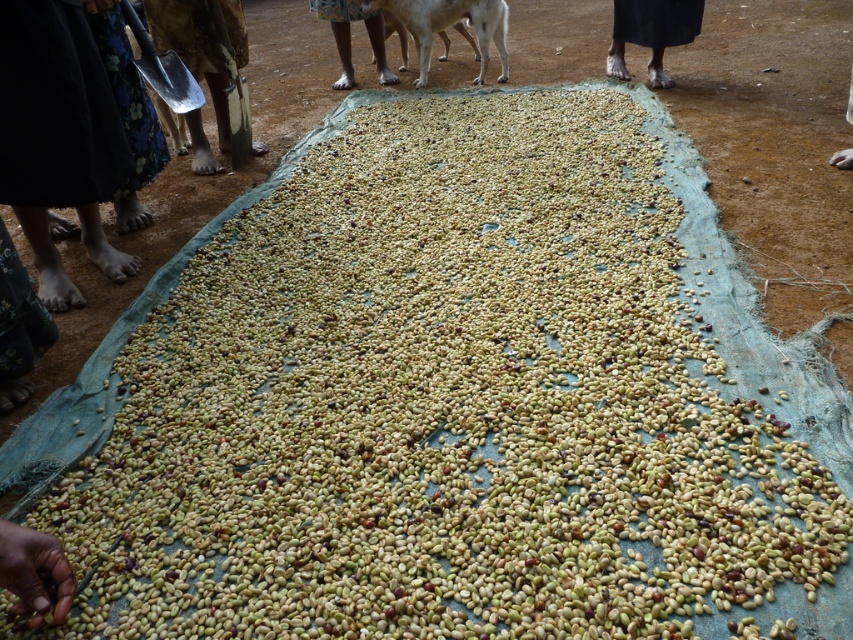
Question: Which point is farther to the camera?

Choices:
 (A) green matte beans at lower left
 (B) black fabric at upper right
 (C) dark blue fabric at lower left

Answer: (B)

Question: Considering the real-world distances, which object is farthest from the green matte beans at lower left?

Choices:
 (A) metal shovel at upper left
 (B) brown skin at center

Answer: (B)

Question: Does white fur dog at center have a lesser width compared to brown skin at center?

Choices:
 (A) no
 (B) yes

Answer: (A)

Question: Is white fur dog at center thinner than black fabric at upper right?

Choices:
 (A) no
 (B) yes

Answer: (A)

Question: Where is green matte beans at lower left located in relation to black fabric at upper right in the image?

Choices:
 (A) left
 (B) right

Answer: (A)

Question: Estimate the real-world distances between objects in this image. Which object is closer to the white fur dog at center?

Choices:
 (A) black fabric at upper right
 (B) green matte beans at lower left
 (C) brown skin at center
 (D) dark blue fabric at lower left

Answer: (C)